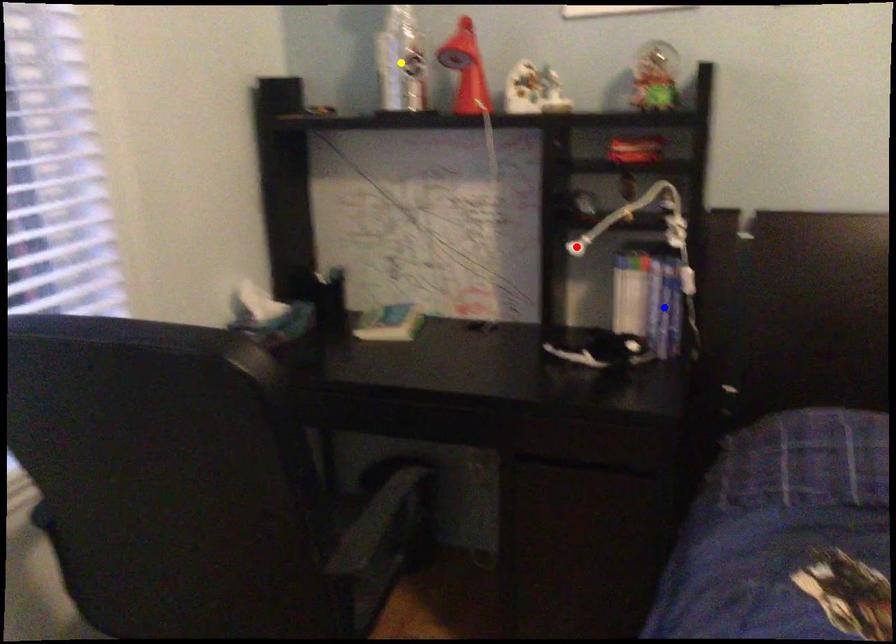
Order these from nearest to farthest:
A) blue point
B) yellow point
C) red point

red point → blue point → yellow point